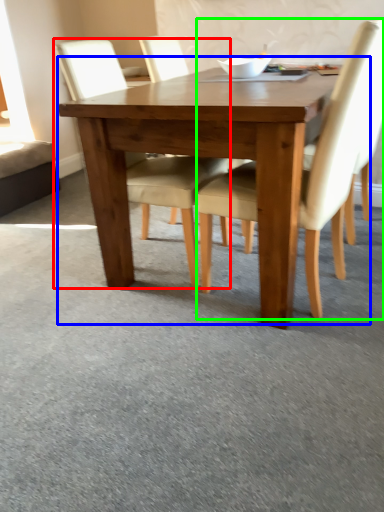
Question: Considering the real-world distances, which object is closest to chair (highlighted by a red box)? kitchen & dining room table (highlighted by a blue box) or chair (highlighted by a green box).

Choices:
 (A) kitchen & dining room table
 (B) chair

Answer: (A)